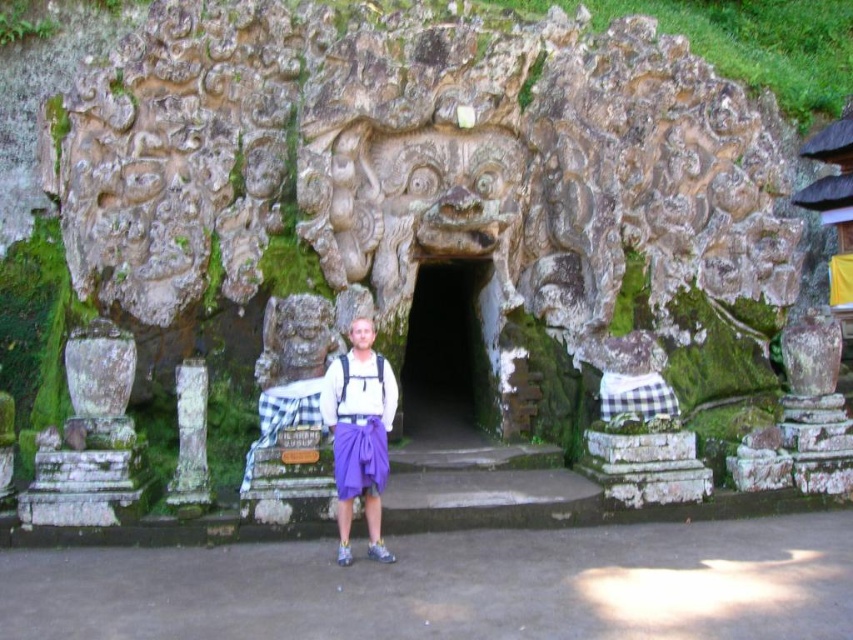
Question: Which point is farther to the camera?

Choices:
 (A) purple fabric apron at center
 (B) purple cotton sarong at center
 (C) dark stone cave at center
 (D) white stone pillar at center

Answer: (C)

Question: Among these points, which one is nearest to the camera?

Choices:
 (A) (352, 337)
 (B) (347, 362)

Answer: (B)

Question: Does dark stone cave at center have a lesser width compared to purple fabric apron at center?

Choices:
 (A) yes
 (B) no

Answer: (B)

Question: Is white stone pillar at center positioned before purple fabric apron at center?

Choices:
 (A) no
 (B) yes

Answer: (A)

Question: Considering the real-world distances, which object is closest to the dark stone cave at center?

Choices:
 (A) purple cotton sarong at center
 (B) white stone pillar at center

Answer: (B)

Question: Is purple cotton sarong at center below white stone pillar at center?

Choices:
 (A) yes
 (B) no

Answer: (A)